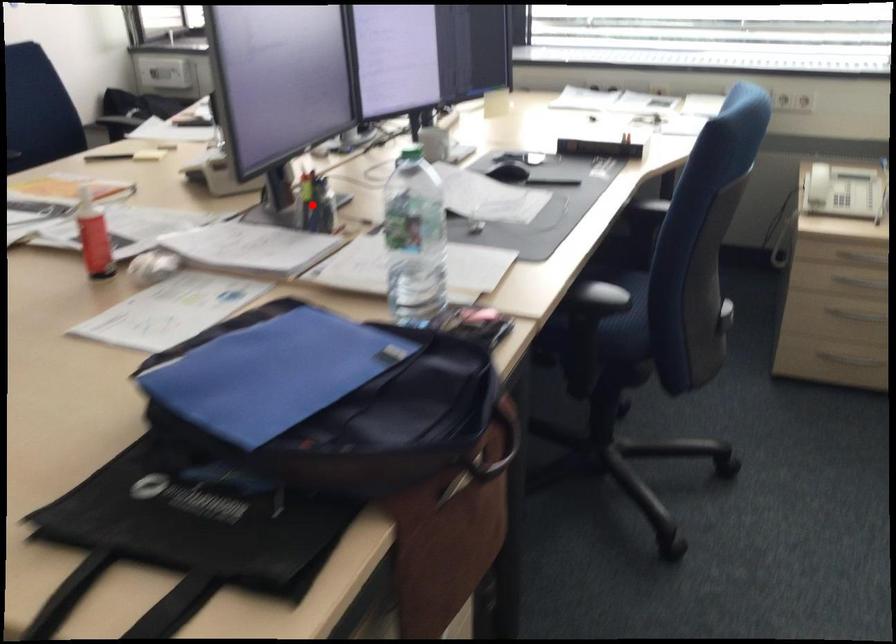
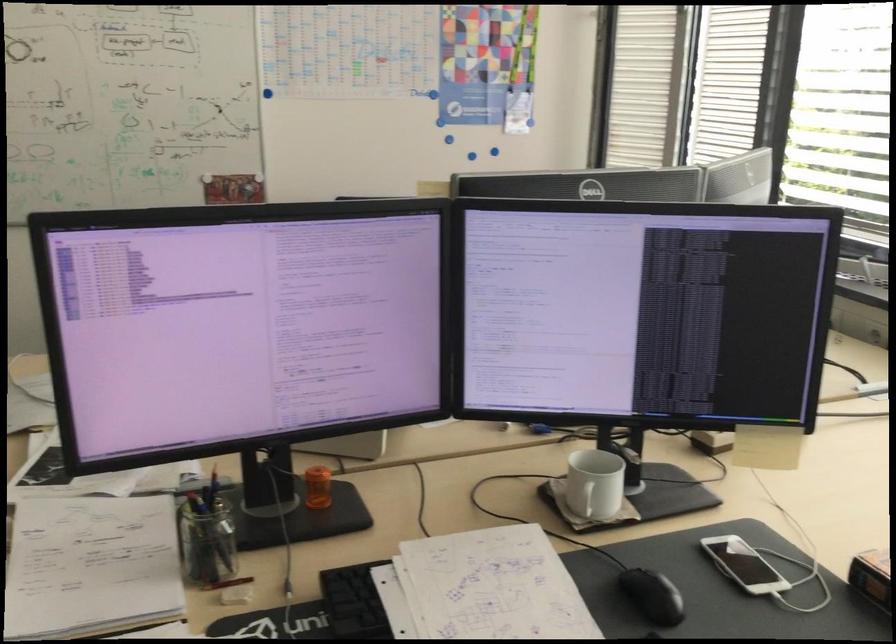
Question: I am providing you with two images of the same scene from different viewpoints. In image1, a red point is highlighted. Considering the same 3D point in image2, which of the following is correct?

Choices:
 (A) It is closer
 (B) It is farther

Answer: (A)